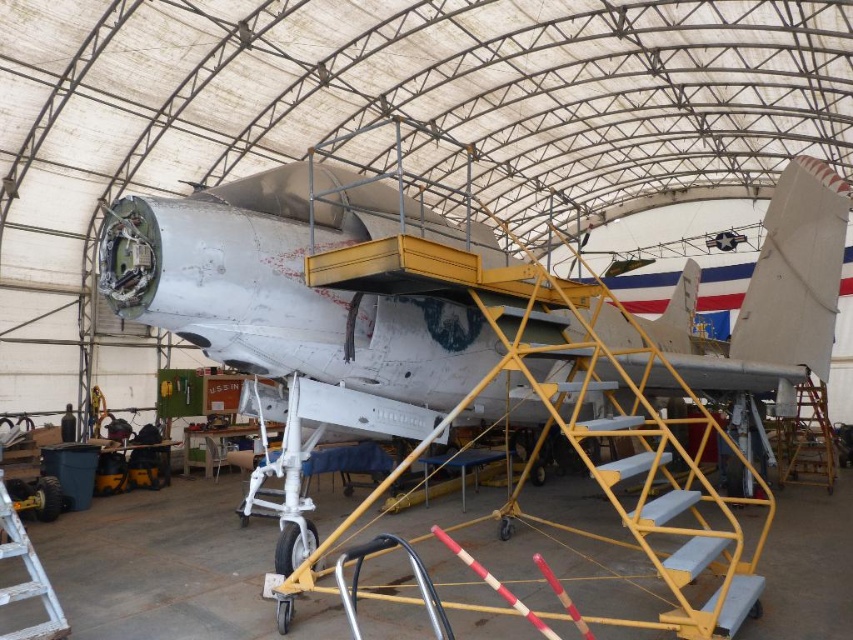
You are a technician standing in the hangar and need to reach both the point at coordinates point (682, 506) and the point at coordinates point (15, 593) on the aircraft. Which point should you approach first if you want to work on the closer one first?

You should approach point (15, 593) first because it is closer to you than point (682, 506), which is further away.

Based on the photo, you are a maintenance worker needing to access the aircraft fuselage. You have to choose between the yellow metallic staircase at center and the white wooden ladder at lower left. Which option requires less floor space to use?

The yellow metallic staircase at center requires less floor space to use since it occupies less space than the white wooden ladder at lower left.

You are a technician needing to reach the cockpit of the vintage military plane in the hangar. You see the yellow metallic ladder at center and the white wooden ladder at lower left. Which ladder is positioned lower in the image?

The yellow metallic ladder at center is below the white wooden ladder at lower left, so the yellow metallic ladder at center is positioned lower in the image.